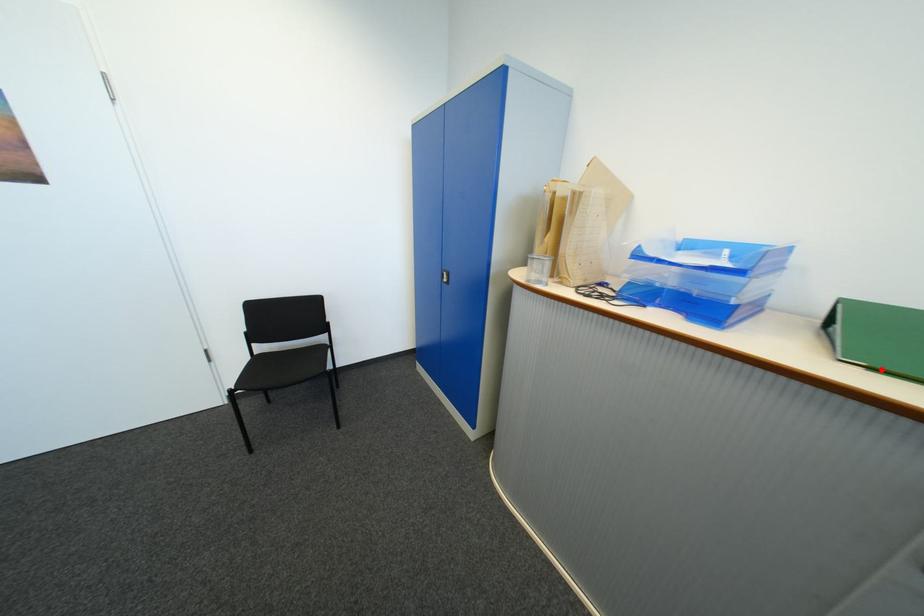
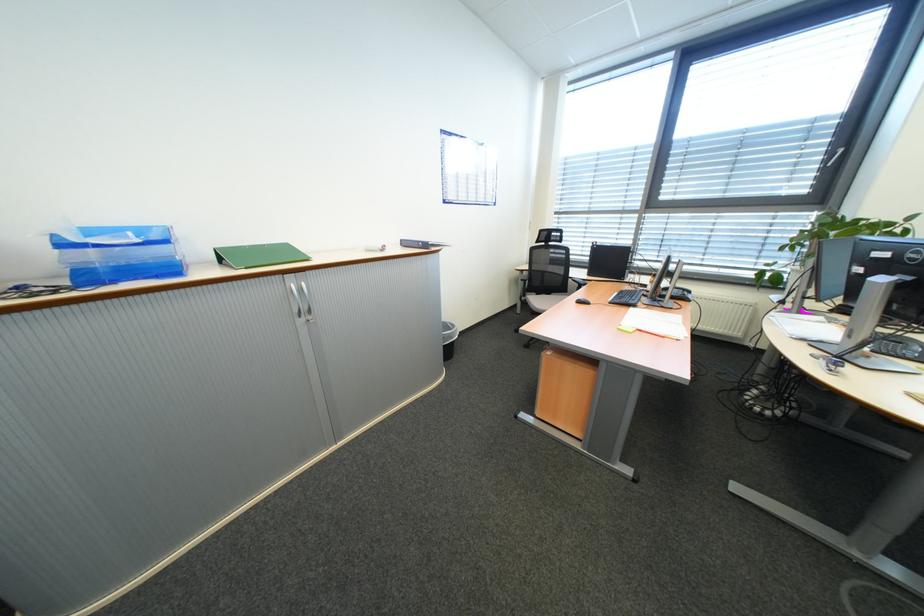
Question: I am providing you with two images of the same scene from different viewpoints. A red point is marked on the first image. Is the red point's position out of view in image 2?

Choices:
 (A) Yes
 (B) No

Answer: (A)